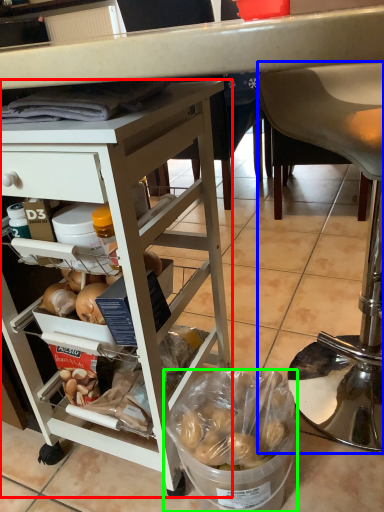
Question: Considering the real-world distances, which object is closest to desk (highlighted by a red box)? chair (highlighted by a blue box) or bowl (highlighted by a green box).

Choices:
 (A) chair
 (B) bowl

Answer: (B)